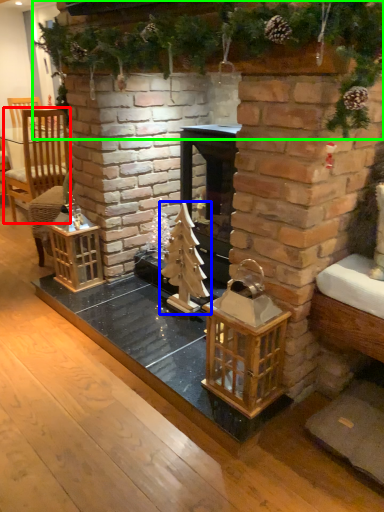
Question: Considering the real-world distances, which object is farthest from armchair (highlighted by a red box)? christmas tree (highlighted by a blue box) or christmas decoration (highlighted by a green box)?

Choices:
 (A) christmas tree
 (B) christmas decoration

Answer: (A)